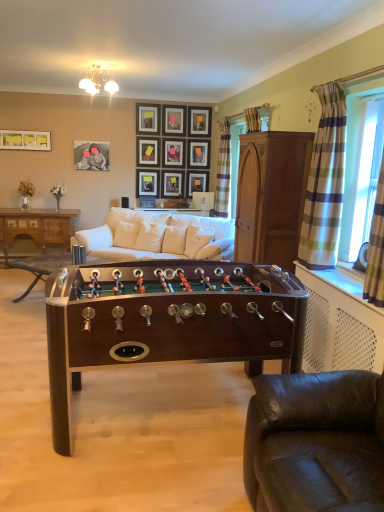
Question: In terms of width, does matte black picture frame at upper center, arranged as the 5th picture frame when viewed from the right, look wider or thinner when compared to mahogany wood cabinet at right?

Choices:
 (A) thin
 (B) wide

Answer: (A)

Question: Is matte black picture frame at upper center, positioned as the sixth picture frame in left-to-right order, in front of or behind mahogany wood cabinet at right in the image?

Choices:
 (A) front
 (B) behind

Answer: (B)

Question: Estimate the real-world distances between objects in this image. Which object is farther from the mahogany wood cabinet at right?

Choices:
 (A) wooden picture frame at upper center, the tenth picture frame when ordered from left to right
 (B) matte black picture frame at center, the 8th picture frame viewed from the left
 (C) white fabric pillow at center, the 3th pillow from the right
 (D) wooden picture frame at upper center, arranged as the 6th picture frame when viewed from the right
 (E) mahogany wood foosball table at center, placed as the 2th table when sorted from front to back

Answer: (A)

Question: Which object is positioned farthest from the matte black picture frame at upper left, which appears as the 1th picture frame when viewed from the left?

Choices:
 (A) mahogany wood foosball table at center, the 2th table from the right
 (B) wooden picture frame at upper center, the 9th picture frame in the left-to-right sequence
 (C) matte black picture frame at upper center, placed as the 8th picture frame when sorted from right to left
 (D) black leather studio couch at lower right, which appears as the 2th studio couch when viewed from the top
 (E) brown wooden cabinet at left, marked as the first table in a back-to-front arrangement

Answer: (D)